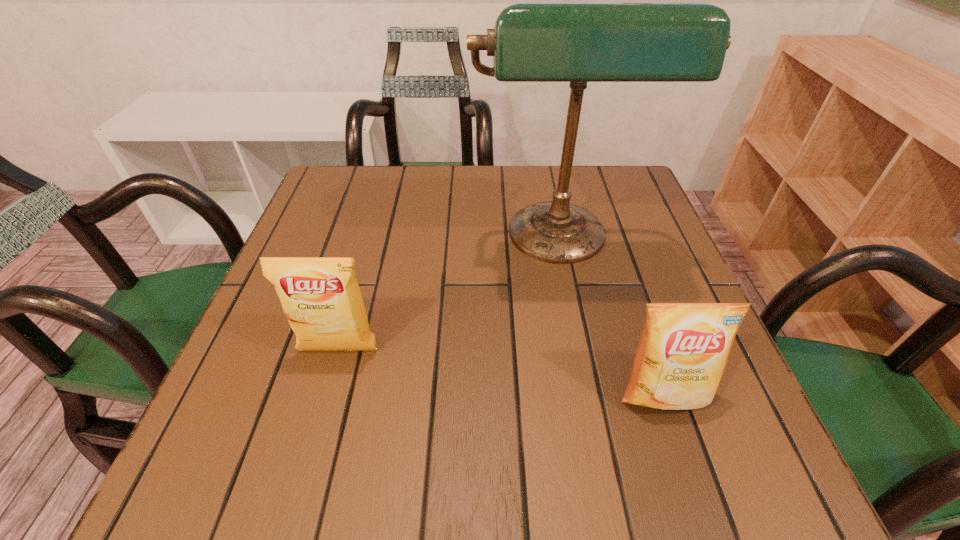
This screenshot has height=540, width=960. What are the coordinates of `free point at the near right corner` in the screenshot? It's located at 660,465.

In order to click on free spot between the left crisp (potato chip) and the nearer crisp (potato chip) in this screenshot , I will do `click(501, 373)`.

I want to click on unoccupied area between the nearer crisp (potato chip) and the second nearest object, so click(501, 373).

Where is `vacant area that lies between the nearer crisp (potato chip) and the leftmost object`? This screenshot has width=960, height=540. vacant area that lies between the nearer crisp (potato chip) and the leftmost object is located at coordinates (501, 373).

Find the location of a particular element. vacant space in between the farthest object and the left crisp (potato chip) is located at coordinates (449, 296).

Where is `free space between the tallest object and the left crisp (potato chip)`? free space between the tallest object and the left crisp (potato chip) is located at coordinates (449, 296).

The image size is (960, 540). Find the location of `empty space that is in between the second farthest object and the nearer crisp (potato chip)`. empty space that is in between the second farthest object and the nearer crisp (potato chip) is located at coordinates (501, 373).

This screenshot has width=960, height=540. I want to click on empty space between the table lamp and the leftmost object, so click(449, 296).

Image resolution: width=960 pixels, height=540 pixels. I want to click on free space between the left crisp (potato chip) and the nearest object, so click(501, 373).

Where is `free space between the nearest object and the tallest object`? free space between the nearest object and the tallest object is located at coordinates (611, 318).